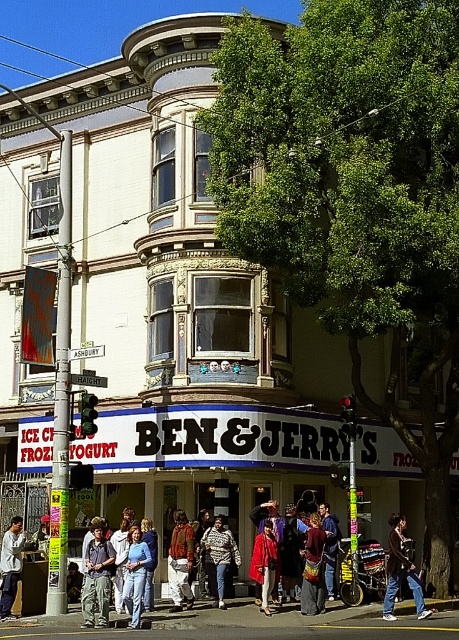
Question: Is multicolored clothing at center to the left of denim jeans at center from the viewer's perspective?

Choices:
 (A) yes
 (B) no

Answer: (B)

Question: Among these points, which one is farthest from the camera?

Choices:
 (A) (314, 577)
 (B) (171, 593)
 (C) (177, 624)

Answer: (B)

Question: Is brown leather jacket at center positioned at the back of denim jacket at lower left?

Choices:
 (A) yes
 (B) no

Answer: (B)

Question: Which point appears closest to the camera in this image?

Choices:
 (A) (106, 604)
 (B) (414, 566)
 (C) (189, 600)
 (D) (262, 556)

Answer: (A)

Question: Is brown leather jacket at center above red fabric dress at center?

Choices:
 (A) yes
 (B) no

Answer: (A)

Question: Among these objects, which one is farthest from the camera?

Choices:
 (A) red sweater at center
 (B) orange and brown striped shirt at center
 (C) red fabric dress at center
 (D) multicolored woven bag at center

Answer: (A)